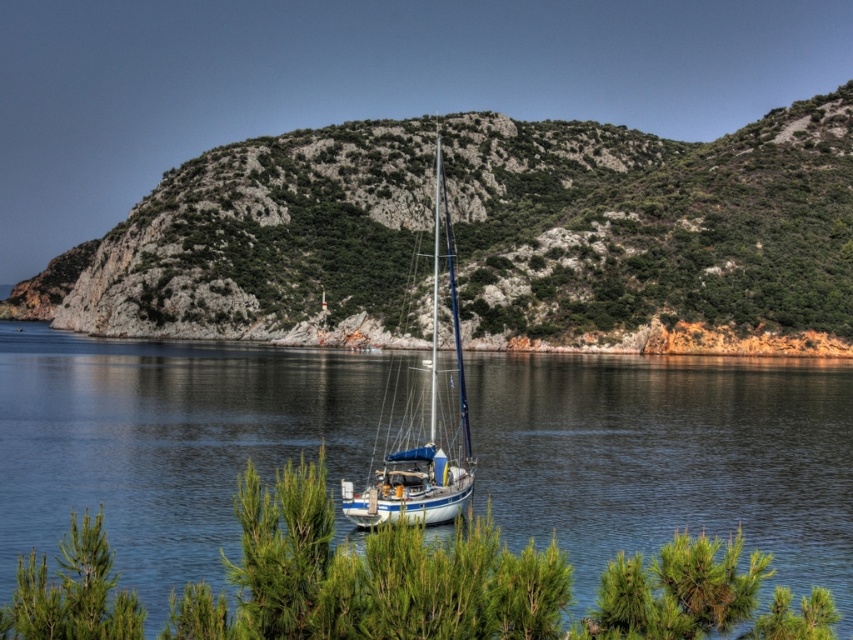
You are standing at the point marked by the coordinate point [669,458]. Based on the scene described, what is the immediate environment around your current location?

The blue water at center is represented by point [669,458], so you are standing in the blue water at center.

You are a photographer planning to capture the white glossy sailboat at center and the green rocky hillside at center in a single shot. Based on their sizes, which object should you prioritize positioning closer to the camera to ensure both fit in the frame?

The green rocky hillside at center is wider than the white glossy sailboat at center, so you should prioritize positioning the green rocky hillside at center closer to the camera to ensure both fit in the frame.